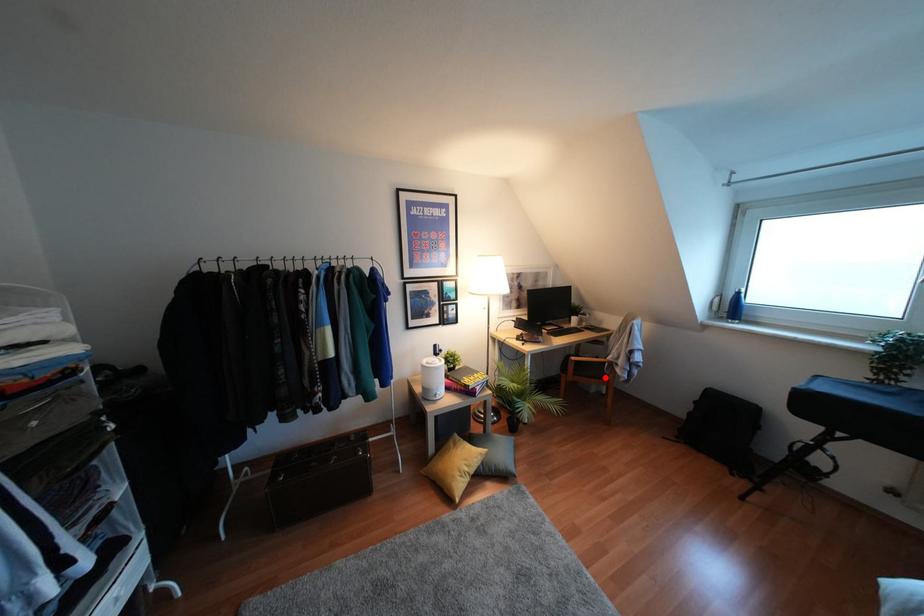
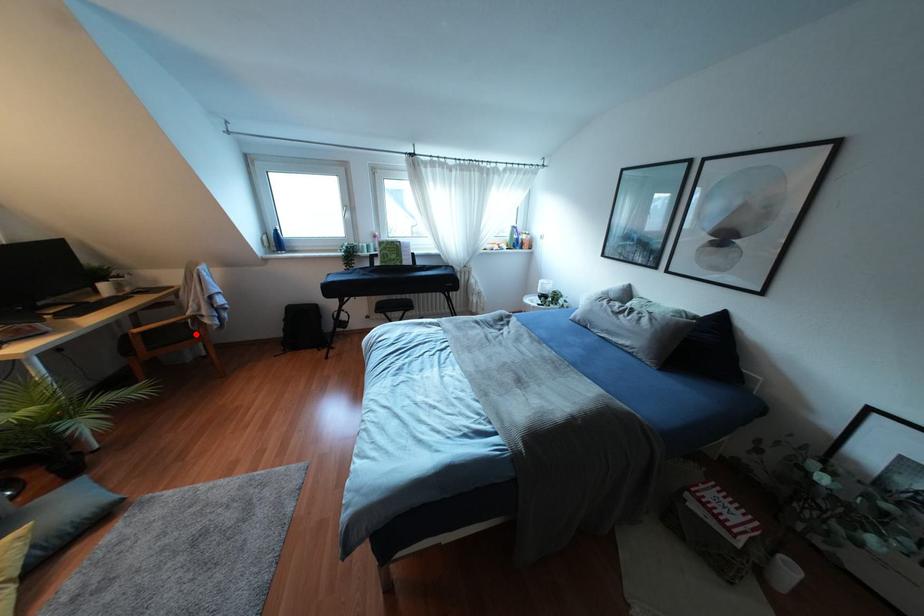
Looking at this image, I am providing you with two images of the same scene from different viewpoints. A red point is marked on the first image and another point is marked on the second image. Are the points marked in image1 and image2 representing the same 3D position?

Yes